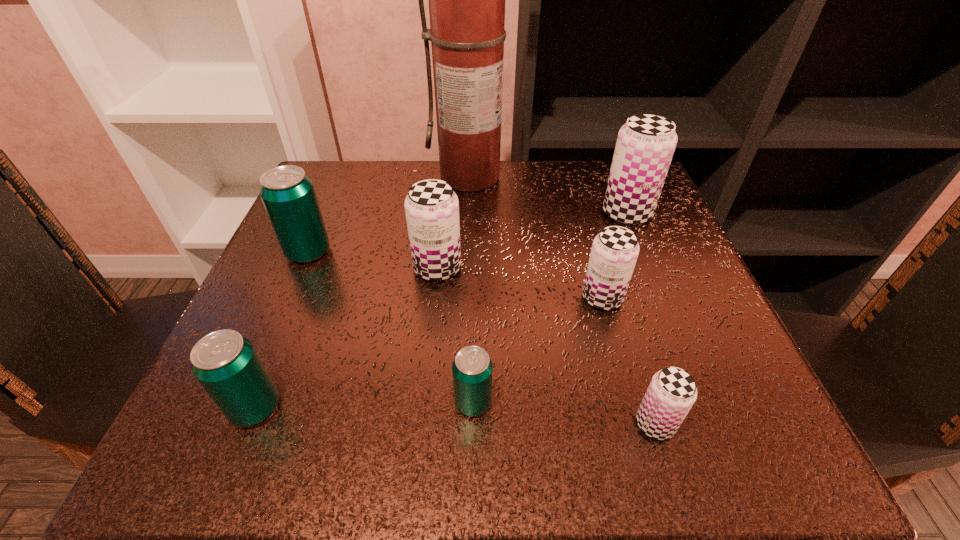
The image size is (960, 540). What are the coordinates of `object that is at the near left corner` in the screenshot? It's located at coord(225,363).

Locate an element on the screen. The image size is (960, 540). object at the far right corner is located at coordinates (645, 145).

At what (x,y) coordinates should I click in order to perform the action: click on object that is positioned at the near right corner. Please return your answer as a coordinate pair (x, y). This screenshot has width=960, height=540. Looking at the image, I should click on (672, 391).

The width and height of the screenshot is (960, 540). In order to click on vacant space at the far edge in this screenshot , I will do `click(518, 197)`.

The image size is (960, 540). Find the location of `vacant space at the near edge`. vacant space at the near edge is located at coordinates (516, 409).

Identify the location of vacant space at the left edge. This screenshot has height=540, width=960. (x=287, y=309).

This screenshot has height=540, width=960. In order to click on blank space at the right edge of the desktop in this screenshot , I will do `click(635, 271)`.

This screenshot has width=960, height=540. I want to click on unoccupied position between the nearest purple beer can and the tallest beer can, so click(641, 319).

I want to click on empty space between the leftmost purple beer can and the third biggest purple beer can, so click(x=519, y=283).

Find the location of a particular element. vacant space in between the rightmost teal beer can and the fire extinguisher is located at coordinates (472, 289).